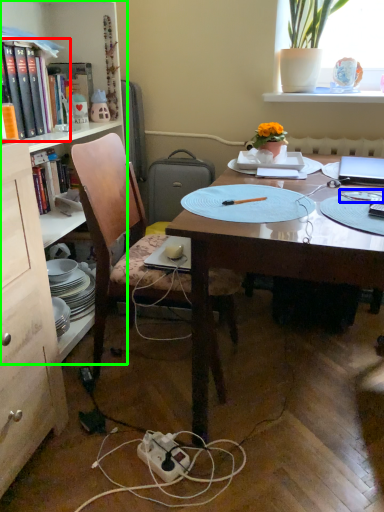
Question: Based on their relative distances, which object is farther from book (highlighted by a red box)? Choose from tableware (highlighted by a blue box) and bookcase (highlighted by a green box).

Choices:
 (A) tableware
 (B) bookcase

Answer: (A)